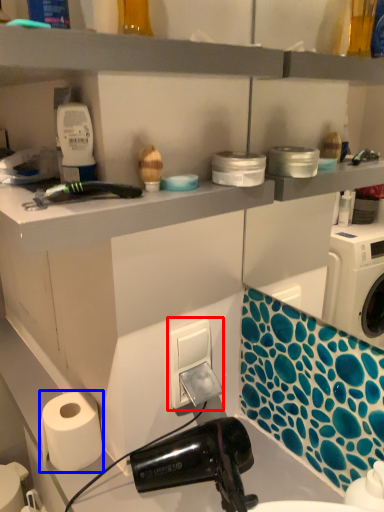
Question: Which of the following is the farthest to the observer, electric outlet (highlighted by a red box) or paper towel (highlighted by a blue box)?

Choices:
 (A) electric outlet
 (B) paper towel

Answer: (A)